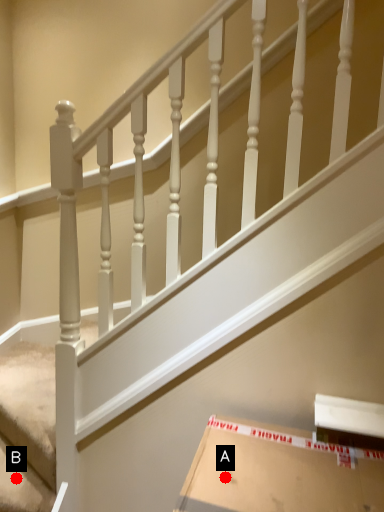
Question: Two points are circled on the image, labeled by A and B beside each circle. Which point is closer to the camera taking this photo?

Choices:
 (A) A is closer
 (B) B is closer

Answer: (A)